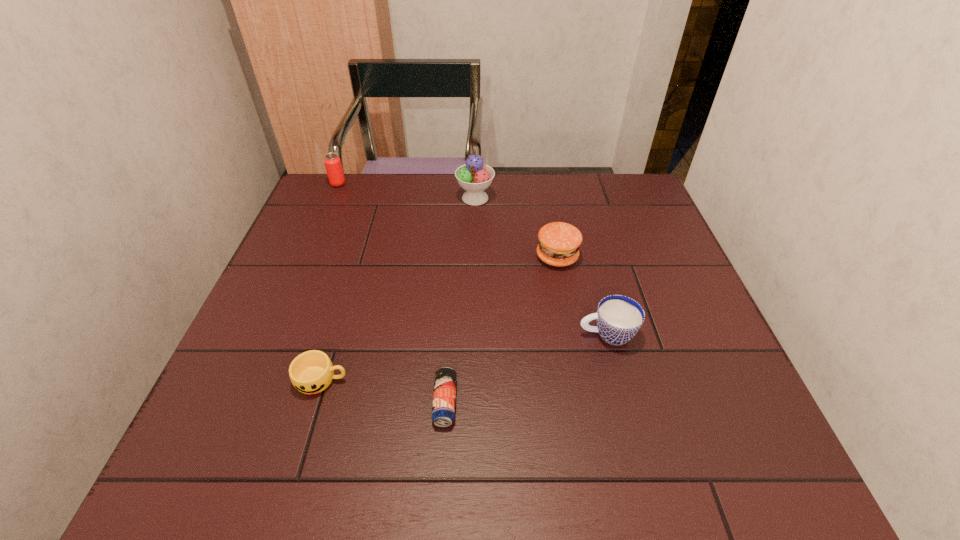
Locate an element on the screen. The height and width of the screenshot is (540, 960). the tallest object is located at coordinates [474, 176].

This screenshot has width=960, height=540. Identify the location of the farther beer can. (332, 162).

I want to click on the leftmost object, so click(332, 162).

I want to click on patty, so click(x=559, y=242).

This screenshot has height=540, width=960. I want to click on the farther cup, so click(619, 318).

This screenshot has width=960, height=540. I want to click on the taller cup, so [619, 318].

This screenshot has height=540, width=960. I want to click on the fifth object from right to left, so pyautogui.click(x=311, y=372).

Where is `the left cup`? the left cup is located at coordinates (311, 372).

You are a GUI agent. You are given a task and a screenshot of the screen. Output one action in this format:
    pyautogui.click(x=<x>, y=<y>)
    Task: Click on the right beer can
    This screenshot has width=960, height=540.
    Given the screenshot: What is the action you would take?
    pyautogui.click(x=444, y=396)

The width and height of the screenshot is (960, 540). Find the location of `the nearer beer can`. the nearer beer can is located at coordinates (444, 396).